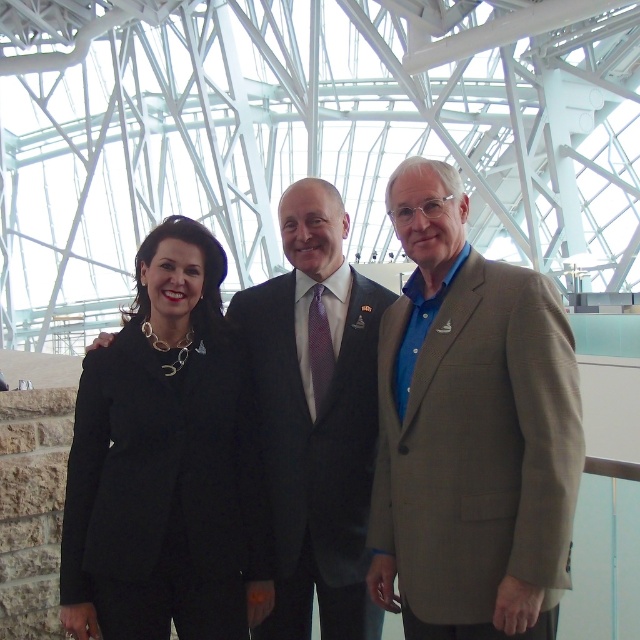
Based on the photo, who is more forward, (227, 605) or (355, 273)?

Point (227, 605)

Which is behind, point (152, 579) or point (328, 520)?

The point (328, 520) is behind.

Identify the location of black fabric suit at left. pyautogui.click(x=163, y=461).

Is light brown textured blazer at center above dark gray suit at center?

Indeed, light brown textured blazer at center is positioned over dark gray suit at center.

Can you confirm if light brown textured blazer at center is smaller than dark gray suit at center?

Actually, light brown textured blazer at center might be larger than dark gray suit at center.

What do you see at coordinates (470, 429) in the screenshot? I see `light brown textured blazer at center` at bounding box center [470, 429].

The image size is (640, 640). Find the location of `light brown textured blazer at center`. light brown textured blazer at center is located at coordinates (470, 429).

Consider the image. Is black fabric suit at center smaller than black fabric suit at left?

Incorrect, black fabric suit at center is not smaller in size than black fabric suit at left.

Is black fabric suit at center bigger than black fabric suit at left?

Correct, black fabric suit at center is larger in size than black fabric suit at left.

Find the location of `black fabric suit at center`. black fabric suit at center is located at coordinates (472, 429).

Find the location of `black fabric suit at center`. black fabric suit at center is located at coordinates (472, 429).